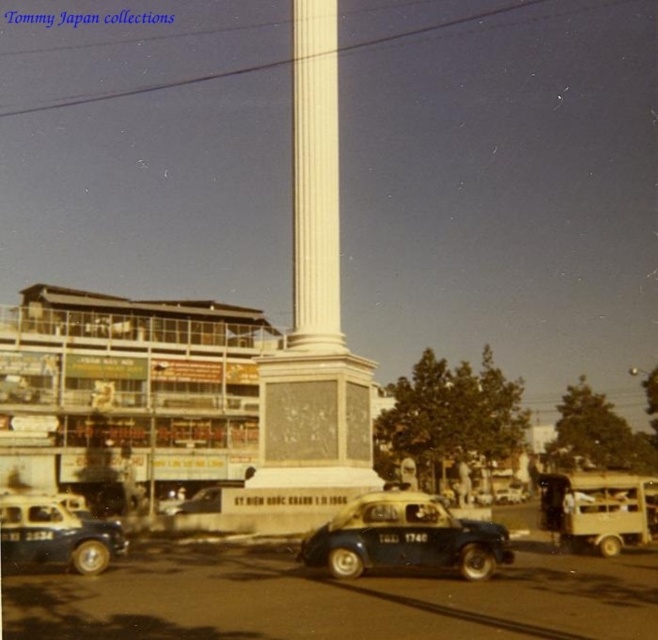
Question: Does blue matte car at center lie in front of blue matte taxi at lower left?

Choices:
 (A) no
 (B) yes

Answer: (B)

Question: Which is farther from the blue matte taxi at lower left?

Choices:
 (A) metallic blue car at center
 (B) blue matte car at center

Answer: (A)

Question: Is blue matte car at center to the left of blue matte taxi at lower left from the viewer's perspective?

Choices:
 (A) yes
 (B) no

Answer: (B)

Question: Which point is farther from the camera taking this photo?

Choices:
 (A) (415, 518)
 (B) (91, 534)

Answer: (B)

Question: Which is farther from the blue matte car at center?

Choices:
 (A) metallic blue car at center
 (B) blue matte taxi at lower left

Answer: (A)

Question: Is blue matte car at center further to the viewer compared to metallic blue car at center?

Choices:
 (A) no
 (B) yes

Answer: (A)